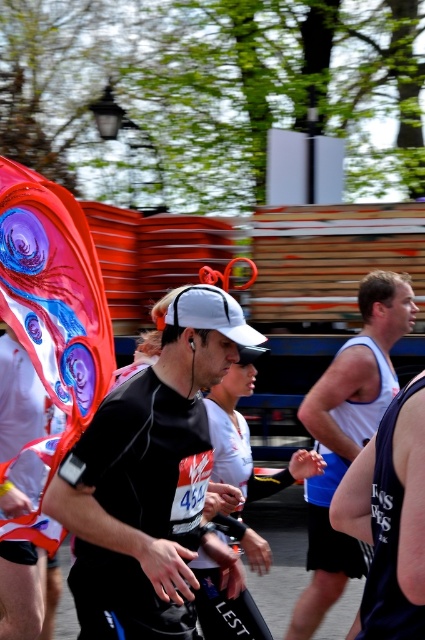
Question: Is black matte running shirt at center smaller than white matte cap at center?

Choices:
 (A) no
 (B) yes

Answer: (B)

Question: Which point is farther from the camera taking this photo?

Choices:
 (A) (314, 513)
 (B) (241, 458)
 (C) (161, 625)

Answer: (A)

Question: Is white tank top at center to the left of white matte cap at center from the viewer's perspective?

Choices:
 (A) no
 (B) yes

Answer: (A)

Question: Which object appears closest to the camera in this image?

Choices:
 (A) white tank top at center
 (B) white matte cap at center

Answer: (B)

Question: Does white tank top at center appear on the right side of white matte cap at center?

Choices:
 (A) yes
 (B) no

Answer: (A)

Question: Among these objects, which one is farthest from the camera?

Choices:
 (A) black matte running shirt at center
 (B) white tank top at center

Answer: (B)